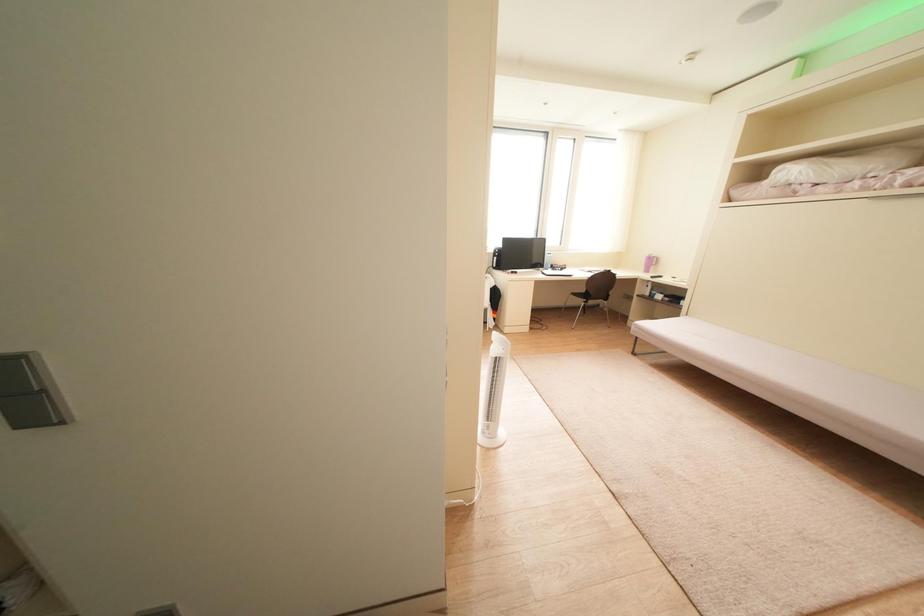
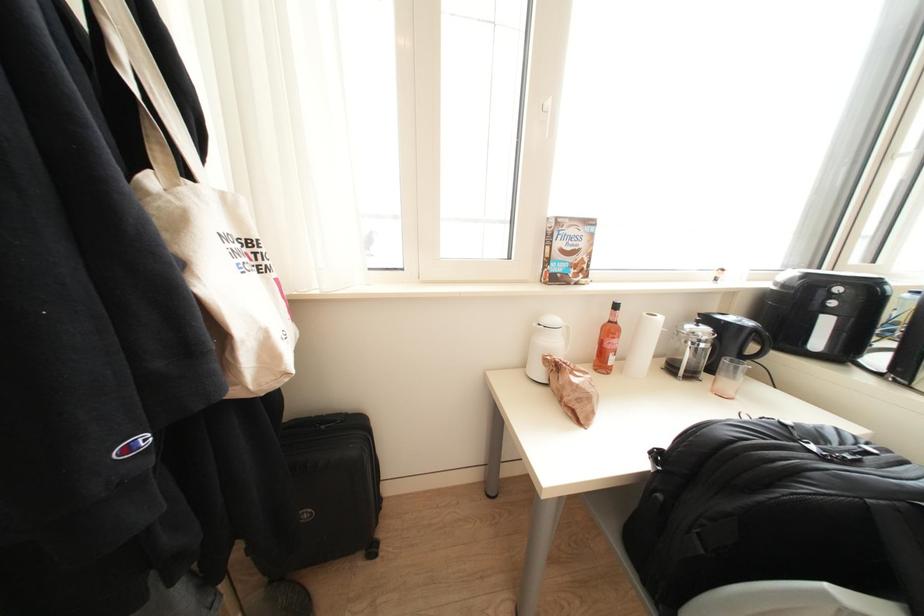
Question: What movement of the cameraman would produce the second image?

Choices:
 (A) Left
 (B) Right
 (C) Forward
 (D) Backward

Answer: (C)